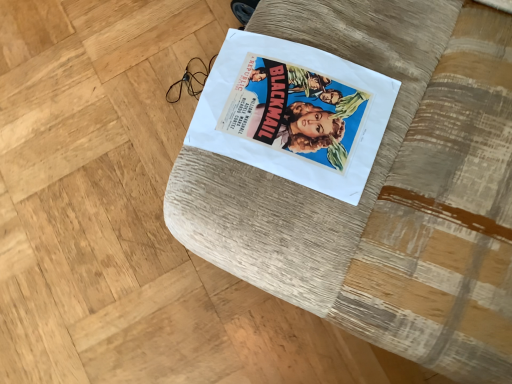
Question: Is white paper at center spatially inside textured fabric cushion at center, or outside of it?

Choices:
 (A) inside
 (B) outside

Answer: (A)

Question: Considering the positions of white paper at center and textured fabric cushion at center in the image, is white paper at center bigger or smaller than textured fabric cushion at center?

Choices:
 (A) big
 (B) small

Answer: (B)

Question: In the image, is white paper at center positioned in front of or behind textured fabric cushion at center?

Choices:
 (A) front
 (B) behind

Answer: (B)

Question: From the image's perspective, is textured fabric cushion at center located above or below white paper at center?

Choices:
 (A) above
 (B) below

Answer: (B)

Question: In terms of height, does textured fabric cushion at center look taller or shorter compared to white paper at center?

Choices:
 (A) short
 (B) tall

Answer: (B)

Question: Visually, is textured fabric cushion at center positioned to the left or to the right of white paper at center?

Choices:
 (A) left
 (B) right

Answer: (B)

Question: From a real-world perspective, relative to white paper at center, is textured fabric cushion at center vertically above or below?

Choices:
 (A) above
 (B) below

Answer: (A)